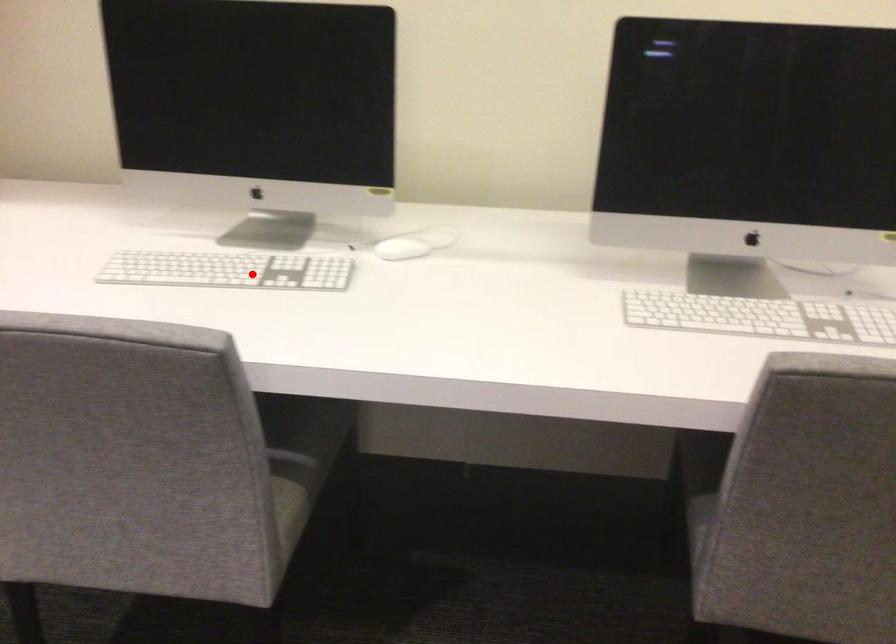
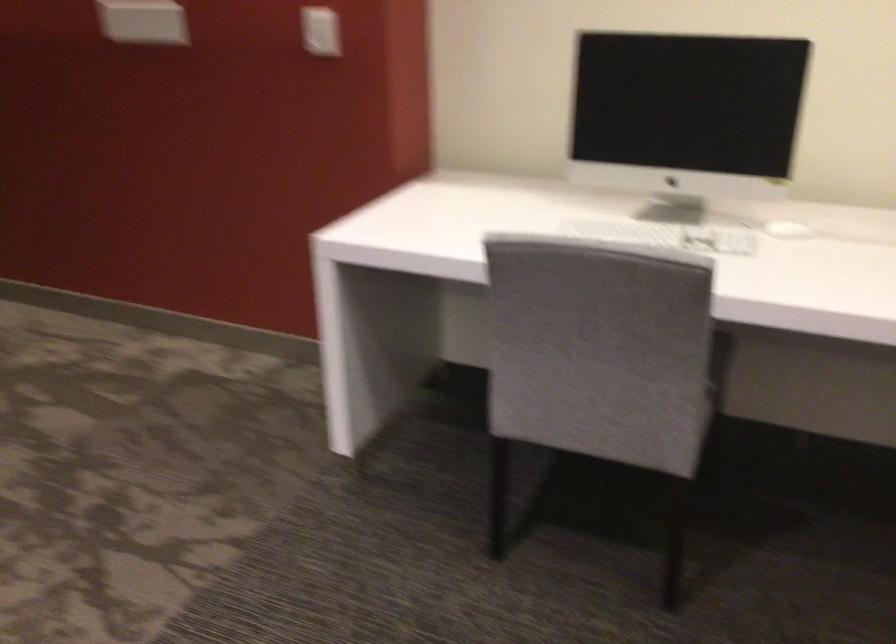
Question: A red point is marked in image1. In image2, is the corresponding 3D point closer to the camera or farther? Reply with the corresponding letter.

Choices:
 (A) The corresponding 3D point is closer.
 (B) The corresponding 3D point is farther.

Answer: (B)